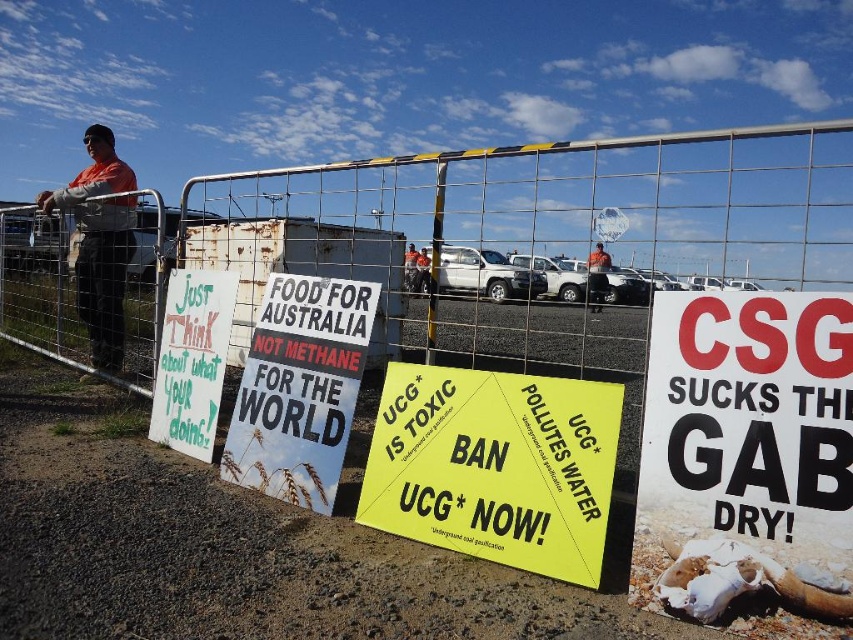
Question: Which of the following is the farthest from the observer?

Choices:
 (A) (183, 353)
 (B) (711, 324)
 (C) (78, 180)

Answer: (C)

Question: From the image, what is the correct spatial relationship of white paper poster at center in relation to green paper sign at center-left?

Choices:
 (A) above
 (B) below

Answer: (B)

Question: Based on their relative distances, which object is farther from the yellow paper sign at center?

Choices:
 (A) orange shirt at center
 (B) green paper sign at center-left

Answer: (A)

Question: Which of the following is the closest to the observer?

Choices:
 (A) (587, 259)
 (B) (605, 384)
 (C) (746, 486)

Answer: (C)

Question: Can you confirm if orange shirt at left is positioned above orange shirt at center?

Choices:
 (A) no
 (B) yes

Answer: (A)

Question: Does white paper poster at center have a lesser width compared to orange shirt at left?

Choices:
 (A) no
 (B) yes

Answer: (A)